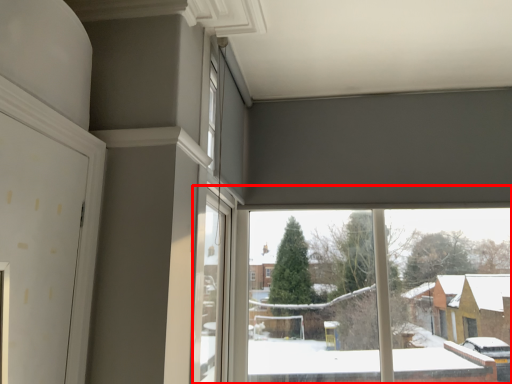
Question: From the image's perspective, considering the relative positions of window (annotated by the red box) and window in the image provided, where is window (annotated by the red box) located with respect to the staircase?

Choices:
 (A) below
 (B) above

Answer: (A)